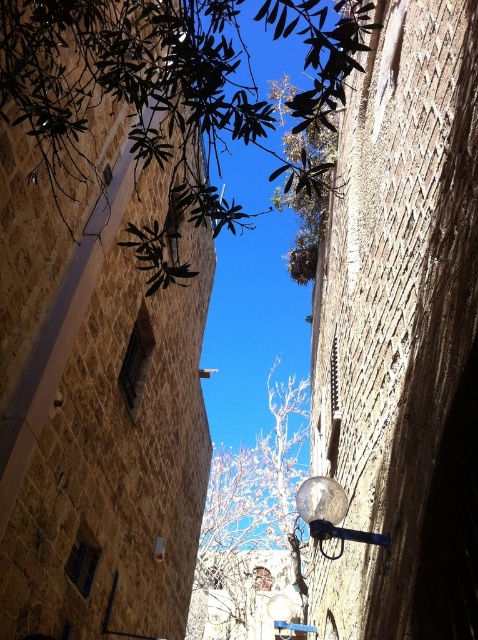
You are a drone operator trying to navigate a drone through this alleyway. The drone has a camera that can focus on specific coordinates. You need to capture a photo of the green leafy tree at upper center. What are the coordinates where you should direct the drone to focus?

The green leafy tree at upper center is located at coordinates point (141, 104), so the drone should focus there to capture the photo.

You are a delivery person with a 1.2 meter wide cart. You need to navigate through the narrow alleyway shown in the image. There are two objects in the center of the alleyway, the bare branches at center and the satin silver globe at center. Can your cart pass between them without touching either object?

The bare branches at center are wider than the satin silver globe at center. Since the cart is 1.2 meters wide, it depends on the combined space between the two objects. However, the description only provides a comparison of their widths, not the distance between them. Without knowing the exact spacing between the objects, it is impossible to determine if the cart can pass safely.

You are standing in the alleyway and want to reach a point exactly 10 feet away from your current position. Is the point at coordinates point (141, 132) within that 10 feet range?

The distance between point (141, 132) and the viewer is 13.80 feet, which is beyond the 10 feet range, so the point is not within reach.